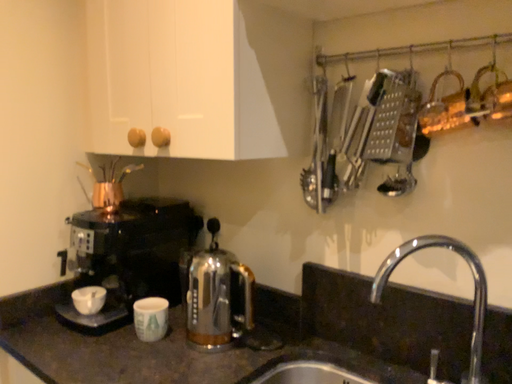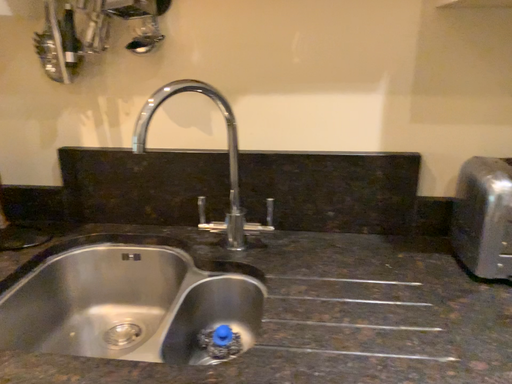
Question: Which way did the camera rotate in the video?

Choices:
 (A) rotated left
 (B) rotated right

Answer: (B)